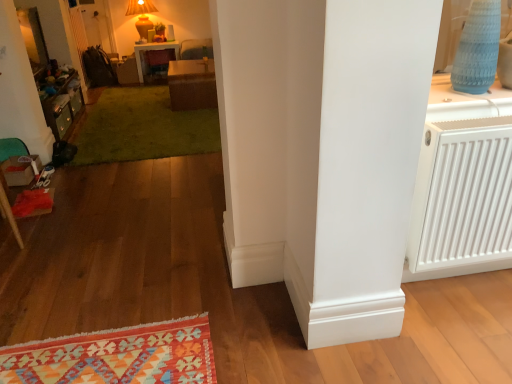
Question: Does brown woven table at center, which is counted as the second table, starting from the back, lie behind matte yellow lamp at upper center?

Choices:
 (A) yes
 (B) no

Answer: (B)

Question: Is brown woven table at center, marked as the 2th table in a left-to-right arrangement, not close to matte yellow lamp at upper center?

Choices:
 (A) yes
 (B) no

Answer: (A)

Question: From a real-world perspective, is brown woven table at center, the second table when ordered from top to bottom, below matte yellow lamp at upper center?

Choices:
 (A) yes
 (B) no

Answer: (A)

Question: Does brown woven table at center, which is counted as the second table, starting from the back, come in front of matte yellow lamp at upper center?

Choices:
 (A) yes
 (B) no

Answer: (A)

Question: Does brown woven table at center, marked as the 2th table in a left-to-right arrangement, appear on the right side of matte yellow lamp at upper center?

Choices:
 (A) yes
 (B) no

Answer: (A)

Question: Considering the positions of wooden dresser at left and green plush rug at center in the image, is wooden dresser at left bigger or smaller than green plush rug at center?

Choices:
 (A) small
 (B) big

Answer: (A)

Question: Does point (60, 114) appear closer or farther from the camera than point (187, 142)?

Choices:
 (A) farther
 (B) closer

Answer: (A)

Question: From a real-world perspective, is wooden dresser at left physically located above or below green plush rug at center?

Choices:
 (A) below
 (B) above

Answer: (B)

Question: Do you think wooden dresser at left is within green plush rug at center, or outside of it?

Choices:
 (A) outside
 (B) inside

Answer: (A)

Question: Considering the relative positions of velvet red armchair at center and brown woven table at center, marked as the 2th table in a left-to-right arrangement, in the image provided, is velvet red armchair at center to the left or to the right of brown woven table at center, marked as the 2th table in a left-to-right arrangement,?

Choices:
 (A) right
 (B) left

Answer: (B)

Question: Based on their sizes in the image, would you say velvet red armchair at center is bigger or smaller than brown woven table at center, which is counted as the second table, starting from the back?

Choices:
 (A) small
 (B) big

Answer: (A)

Question: From a real-world perspective, is velvet red armchair at center positioned above or below brown woven table at center, which is counted as the 1th table, starting from the bottom?

Choices:
 (A) below
 (B) above

Answer: (A)

Question: Considering their positions, is velvet red armchair at center located in front of or behind brown woven table at center, which is counted as the 1th table, starting from the bottom?

Choices:
 (A) behind
 (B) front

Answer: (A)

Question: From their relative heights in the image, would you say brown woven table at center, which is the first table in right-to-left order, is taller or shorter than matte yellow lamp at upper center?

Choices:
 (A) short
 (B) tall

Answer: (A)

Question: Based on their sizes in the image, would you say brown woven table at center, marked as the 2th table in a left-to-right arrangement, is bigger or smaller than matte yellow lamp at upper center?

Choices:
 (A) small
 (B) big

Answer: (B)